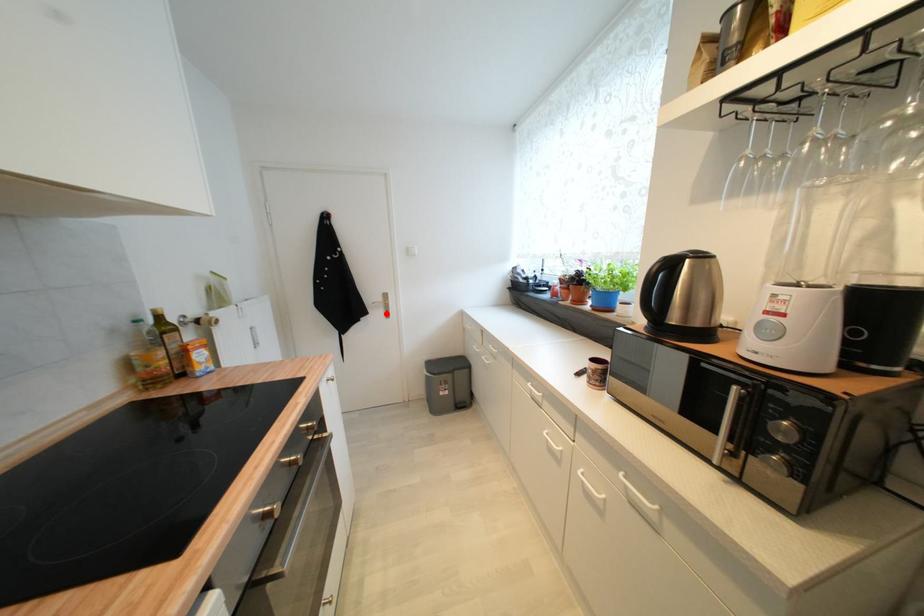
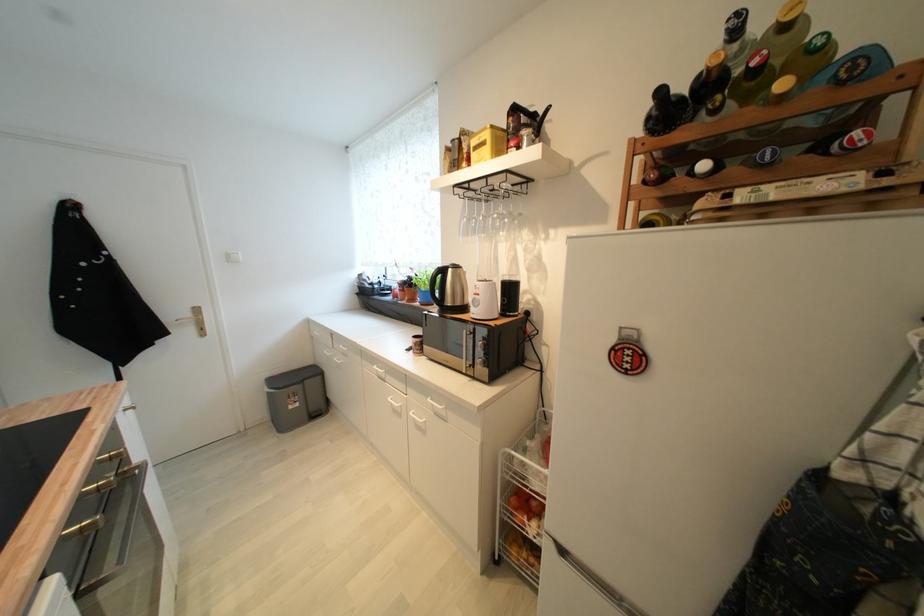
Locate, in the second image, the point that corresponds to the highlighted location in the first image.

(197, 331)